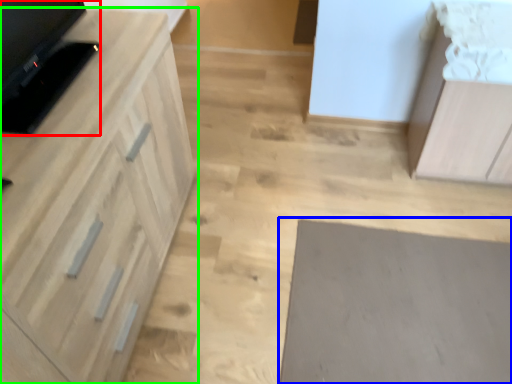
Question: Which object is positioned closest to appliance (highlighted by a red box)? Select from mat (highlighted by a blue box) and cabinetry (highlighted by a green box).

Choices:
 (A) mat
 (B) cabinetry

Answer: (B)